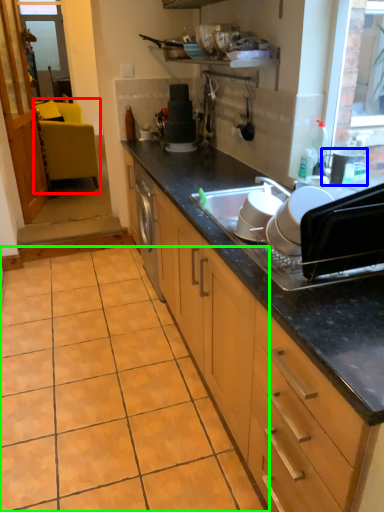
Question: Considering the real-world distances, which object is closest to chair (highlighted by a red box)? appliance (highlighted by a blue box) or ceramic tile (highlighted by a green box).

Choices:
 (A) appliance
 (B) ceramic tile

Answer: (B)